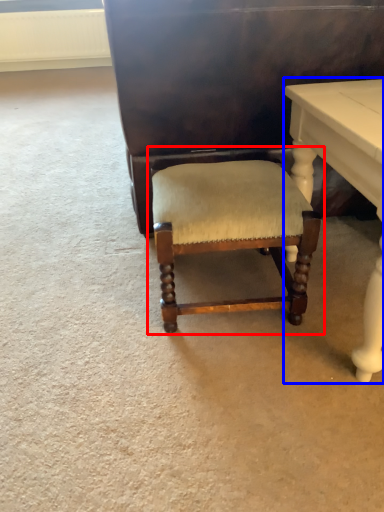
Question: Which object is further to the camera taking this photo, chair (highlighted by a red box) or table (highlighted by a blue box)?

Choices:
 (A) chair
 (B) table

Answer: (A)